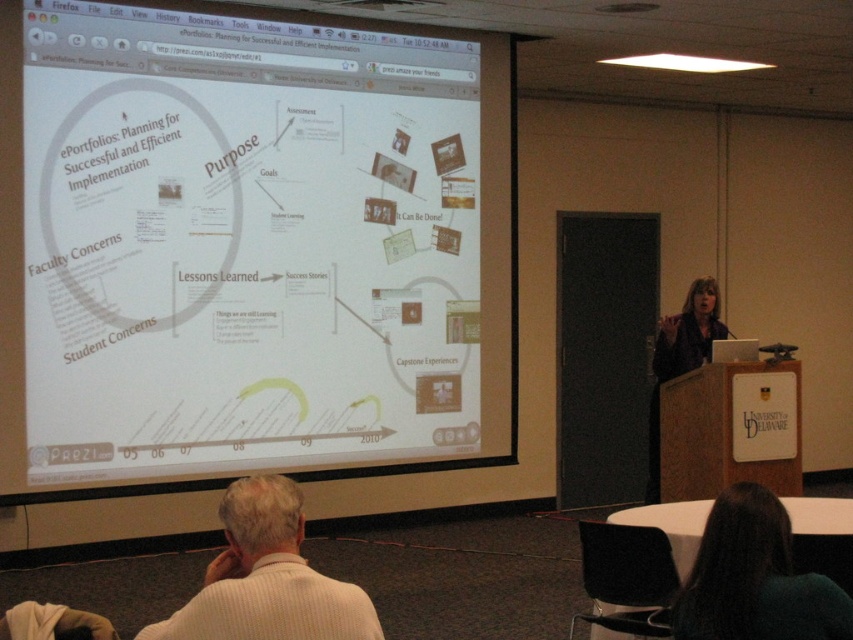
Between dark brown hair at lower right and matte black shirt at center, which one is positioned higher?

Positioned higher is matte black shirt at center.

Which is behind, point (743, 621) or point (689, 344)?

Point (689, 344)

Where is `dark brown hair at lower right`? The width and height of the screenshot is (853, 640). dark brown hair at lower right is located at coordinates (755, 579).

From the picture: Does white paper at upper left lie in front of white textured sweater at lower left?

No, it is behind white textured sweater at lower left.

Which is above, white paper at upper left or white textured sweater at lower left?

Positioned higher is white paper at upper left.

You are a GUI agent. You are given a task and a screenshot of the screen. Output one action in this format:
    pyautogui.click(x=<x>, y=<y>)
    Task: Click on the white paper at upper left
    Image resolution: width=853 pixels, height=640 pixels.
    Given the screenshot: What is the action you would take?
    pyautogui.click(x=248, y=246)

Who is more forward, [13,502] or [651,442]?

Point [13,502] is more forward.

This screenshot has width=853, height=640. In order to click on white paper at upper left in this screenshot , I will do `click(248, 246)`.

The image size is (853, 640). I want to click on white paper at upper left, so click(248, 246).